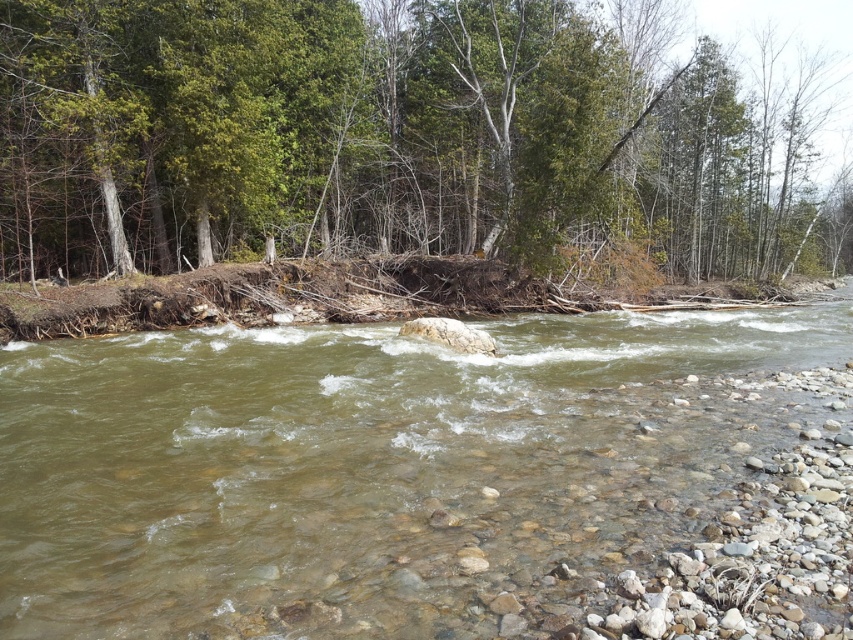
Who is higher up, clear sedimentary rock at center or green leafy tree at upper center?

green leafy tree at upper center is higher up.

Can you confirm if clear sedimentary rock at center is shorter than green leafy tree at upper center?

Yes, clear sedimentary rock at center is shorter than green leafy tree at upper center.

Between point (212, 396) and point (482, 42), which one is positioned in front?

Positioned in front is point (212, 396).

I want to click on clear sedimentary rock at center, so click(363, 467).

This screenshot has width=853, height=640. What do you see at coordinates (363, 467) in the screenshot?
I see `clear sedimentary rock at center` at bounding box center [363, 467].

Can you confirm if clear sedimentary rock at center is positioned below white smooth rock at center?

Correct, clear sedimentary rock at center is located below white smooth rock at center.

Measure the distance between point (293, 444) and camera.

Point (293, 444) is 28.28 feet from camera.

The image size is (853, 640). Find the location of `clear sedimentary rock at center`. clear sedimentary rock at center is located at coordinates (363, 467).

At what (x,y) coordinates should I click in order to perform the action: click on green leafy tree at upper center. Please return your answer as a coordinate pair (x, y). Looking at the image, I should click on (405, 138).

Who is more distant from viewer, (144,148) or (465,348)?

The point (144,148) is behind.

Identify the location of green leafy tree at upper center. The height and width of the screenshot is (640, 853). (405, 138).